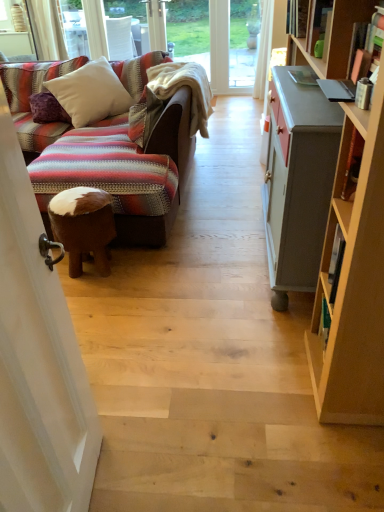
Question: Does transparent glass screen door at upper left come behind purple velvet pillow at left, acting as the 2th pillow starting from the right?

Choices:
 (A) yes
 (B) no

Answer: (B)

Question: Is transparent glass screen door at upper left touching purple velvet pillow at left, acting as the 2th pillow starting from the right?

Choices:
 (A) no
 (B) yes

Answer: (A)

Question: Is transparent glass screen door at upper left far away from purple velvet pillow at left, acting as the 2th pillow starting from the right?

Choices:
 (A) yes
 (B) no

Answer: (A)

Question: Does transparent glass screen door at upper left have a lesser height compared to purple velvet pillow at left, acting as the 2th pillow starting from the right?

Choices:
 (A) yes
 (B) no

Answer: (B)

Question: Is transparent glass screen door at upper left not inside purple velvet pillow at left, acting as the 2th pillow starting from the right?

Choices:
 (A) yes
 (B) no

Answer: (A)

Question: Could you tell me if transparent glass screen door at upper left is facing purple velvet pillow at left, marked as the first pillow in a left-to-right arrangement?

Choices:
 (A) yes
 (B) no

Answer: (B)

Question: Does purple velvet pillow at left, marked as the first pillow in a left-to-right arrangement, appear on the left side of hardcover book at upper right?

Choices:
 (A) no
 (B) yes

Answer: (B)

Question: Is purple velvet pillow at left, acting as the 2th pillow starting from the right, shorter than hardcover book at upper right?

Choices:
 (A) no
 (B) yes

Answer: (A)

Question: From the image's perspective, is purple velvet pillow at left, acting as the 2th pillow starting from the right, on top of hardcover book at upper right?

Choices:
 (A) yes
 (B) no

Answer: (B)

Question: Can you confirm if purple velvet pillow at left, marked as the first pillow in a left-to-right arrangement, is thinner than hardcover book at upper right?

Choices:
 (A) no
 (B) yes

Answer: (A)

Question: Is purple velvet pillow at left, acting as the 2th pillow starting from the right, behind hardcover book at upper right?

Choices:
 (A) no
 (B) yes

Answer: (B)

Question: Is hardcover book at upper right aimed at transparent glass screen door at upper left?

Choices:
 (A) no
 (B) yes

Answer: (A)